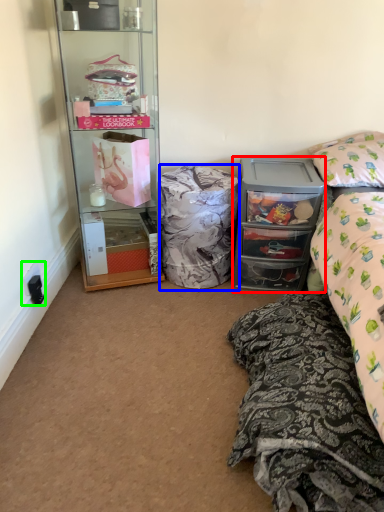
Question: Based on their relative distances, which object is nearer to cabinetry (highlighted by a red box)? Choose from material (highlighted by a blue box) and power outlet (highlighted by a green box).

Choices:
 (A) material
 (B) power outlet

Answer: (A)